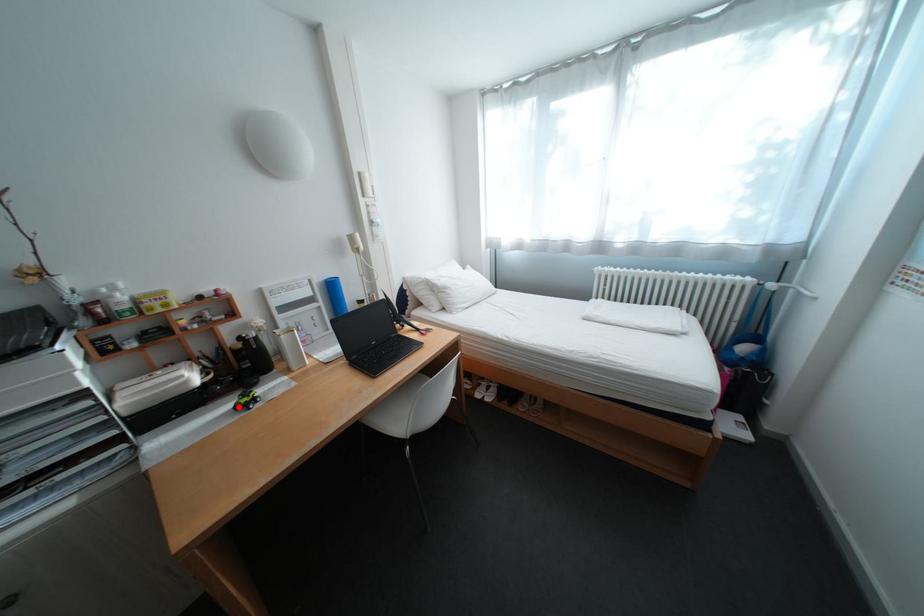
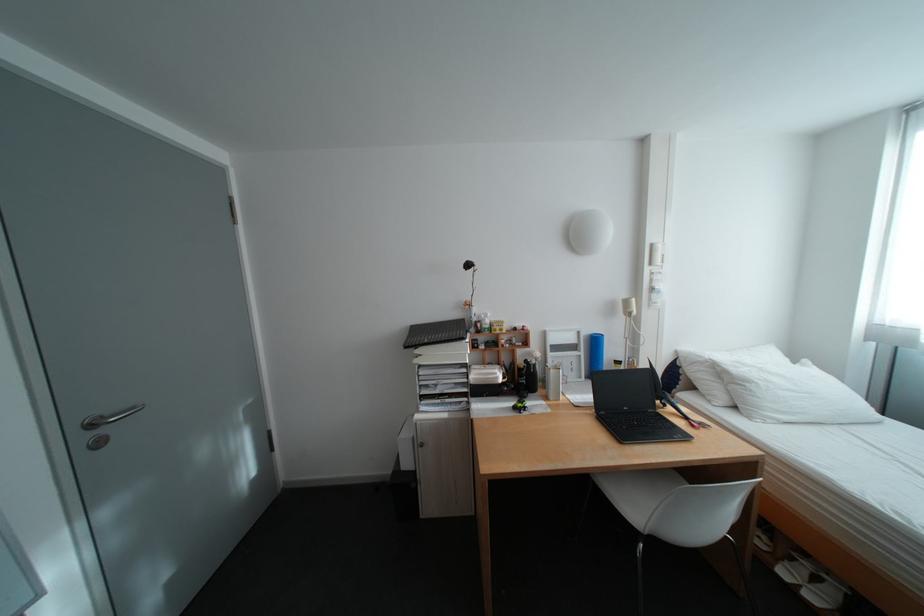
Question: A red point is marked in image1. In image2, is the corresponding 3D point closer to the camera or farther? Reply with the corresponding letter.

Choices:
 (A) The corresponding 3D point is closer.
 (B) The corresponding 3D point is farther.

Answer: (B)